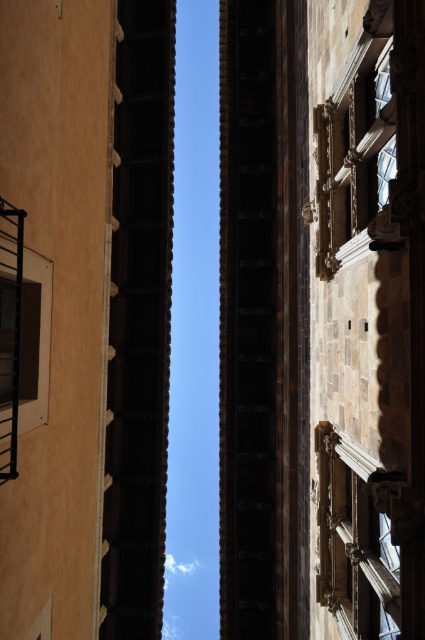
Question: Is polished stone window at lower right smaller than polished stone window at upper center?

Choices:
 (A) yes
 (B) no

Answer: (B)

Question: Which point is closer to the camera taking this photo?

Choices:
 (A) (336, 147)
 (B) (399, 609)

Answer: (B)

Question: Which of the following is the closest to the observer?

Choices:
 (A) (393, 161)
 (B) (348, 552)

Answer: (A)

Question: Can you confirm if polished stone window at lower right is positioned to the left of polished stone window at upper center?

Choices:
 (A) yes
 (B) no

Answer: (A)

Question: Can you confirm if polished stone window at lower right is positioned to the left of polished stone window at upper center?

Choices:
 (A) yes
 (B) no

Answer: (A)